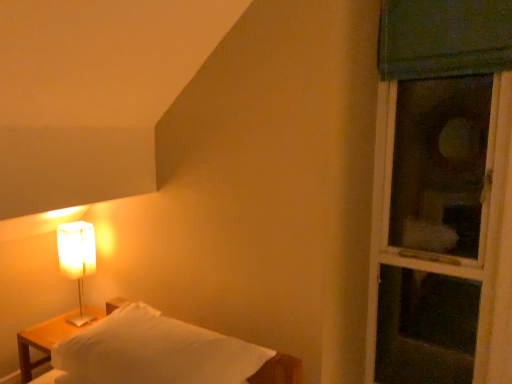
Question: Can you confirm if white matte rectangular lamp at left is thinner than green fabric window at right?

Choices:
 (A) yes
 (B) no

Answer: (A)

Question: From a real-world perspective, is white matte rectangular lamp at left located beneath green fabric window at right?

Choices:
 (A) no
 (B) yes

Answer: (B)

Question: Is white matte rectangular lamp at left positioned behind green fabric window at right?

Choices:
 (A) yes
 (B) no

Answer: (A)

Question: From the image's perspective, would you say white matte rectangular lamp at left is shown under green fabric window at right?

Choices:
 (A) no
 (B) yes

Answer: (B)

Question: Is white matte rectangular lamp at left bigger than green fabric window at right?

Choices:
 (A) yes
 (B) no

Answer: (B)

Question: Is white matte rectangular lamp at left far away from green fabric window at right?

Choices:
 (A) no
 (B) yes

Answer: (B)

Question: From the image's perspective, does green fabric window at right appear lower than wooden nightstand at left?

Choices:
 (A) yes
 (B) no

Answer: (B)

Question: Is green fabric window at right far away from wooden nightstand at left?

Choices:
 (A) no
 (B) yes

Answer: (B)

Question: Is wooden nightstand at left a part of green fabric window at right?

Choices:
 (A) no
 (B) yes

Answer: (A)

Question: Is green fabric window at right located outside wooden nightstand at left?

Choices:
 (A) yes
 (B) no

Answer: (A)

Question: Considering the relative positions of green fabric window at right and wooden nightstand at left in the image provided, is green fabric window at right behind wooden nightstand at left?

Choices:
 (A) yes
 (B) no

Answer: (B)

Question: Is green fabric window at right to the left of wooden nightstand at left from the viewer's perspective?

Choices:
 (A) yes
 (B) no

Answer: (B)

Question: Is green fabric window at right aimed at white matte rectangular lamp at left?

Choices:
 (A) yes
 (B) no

Answer: (B)